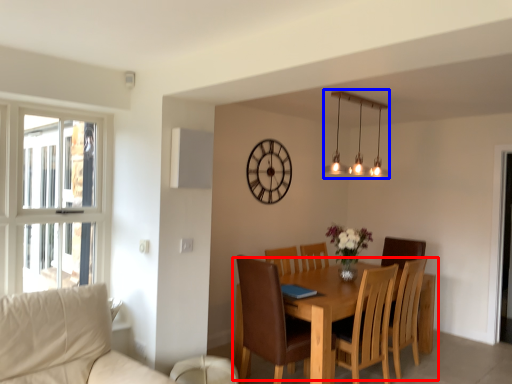
Question: Among these objects, which one is farthest to the camera, kitchen & dining room table (highlighted by a red box) or lamp (highlighted by a blue box)?

Choices:
 (A) kitchen & dining room table
 (B) lamp

Answer: (B)